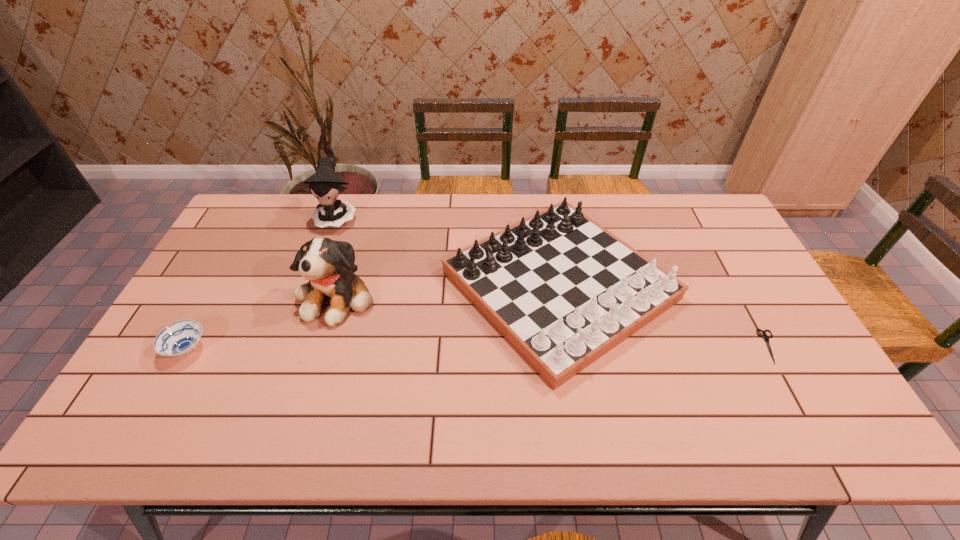
You are a GUI agent. You are given a task and a screenshot of the screen. Output one action in this format:
    pyautogui.click(x=<x>, y=<y>)
    Task: Click on the doll
    This screenshot has height=540, width=960.
    Given the screenshot: What is the action you would take?
    pyautogui.click(x=325, y=185)

The image size is (960, 540). What are the coordinates of `puppy` in the screenshot? It's located at (329, 266).

Where is `the third shortest object`? This screenshot has height=540, width=960. the third shortest object is located at coordinates (563, 291).

The height and width of the screenshot is (540, 960). I want to click on the fourth object from left to right, so click(x=563, y=291).

The height and width of the screenshot is (540, 960). Find the location of `the leftmost object`. the leftmost object is located at coordinates (180, 338).

Where is `soup bowl`? This screenshot has width=960, height=540. soup bowl is located at coordinates (180, 338).

In order to click on the shortest object in this screenshot , I will do `click(766, 338)`.

Identify the location of shears. The image size is (960, 540). (766, 338).

Where is `free location located at the face of the doll`? This screenshot has width=960, height=540. free location located at the face of the doll is located at coordinates (298, 328).

Image resolution: width=960 pixels, height=540 pixels. Identify the location of blank space located 0.110m at the face of the puppy. (317, 363).